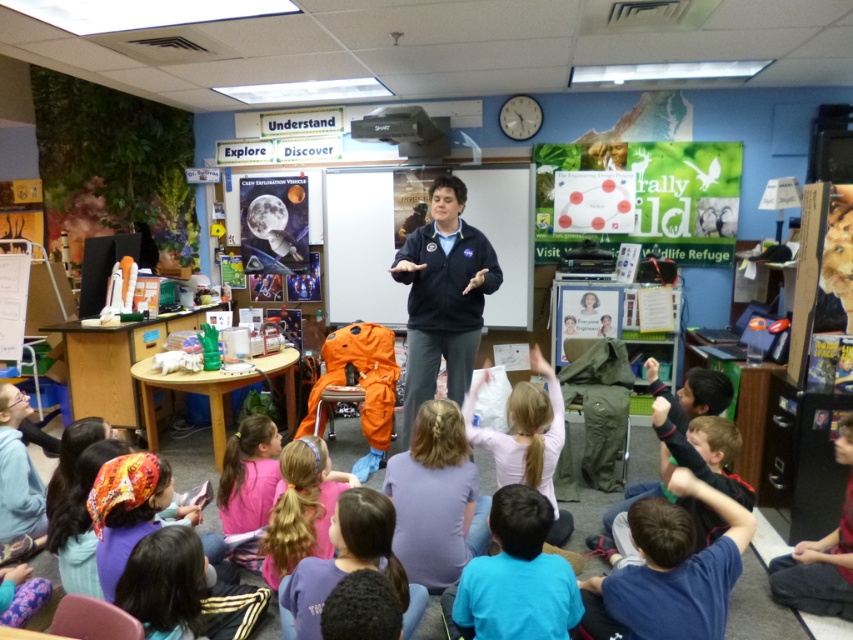
You are standing in the classroom and want to locate the pink fabric ponytail at lower center. According to the coordinates provided, where should you look?

You should look at point (x=300, y=508) to find the pink fabric ponytail at lower center.

You are a photographer in the classroom and want to take a photo of the pink fabric ponytail at lower center and dark blue jeans at lower right. Which object should you focus on first if you want to capture both in a single shot without moving the camera?

The pink fabric ponytail at lower center is located above dark blue jeans at lower right, so you should focus on the pink fabric ponytail at lower center first since it is closer to the camera.

You are a teacher standing at the front of the classroom. You need to walk to the whiteboard to write something. The whiteboard is located behind the presenter. Can you walk directly to the whiteboard without stepping over the dark blue jacket at center or the purple cotton shirt at lower center?

The distance between the dark blue jacket at center and the purple cotton shirt at lower center is 5.22 feet. Since the whiteboard is behind the presenter, you can walk around either side of the children to reach the whiteboard without stepping over either the dark blue jacket at center or the purple cotton shirt at lower center.